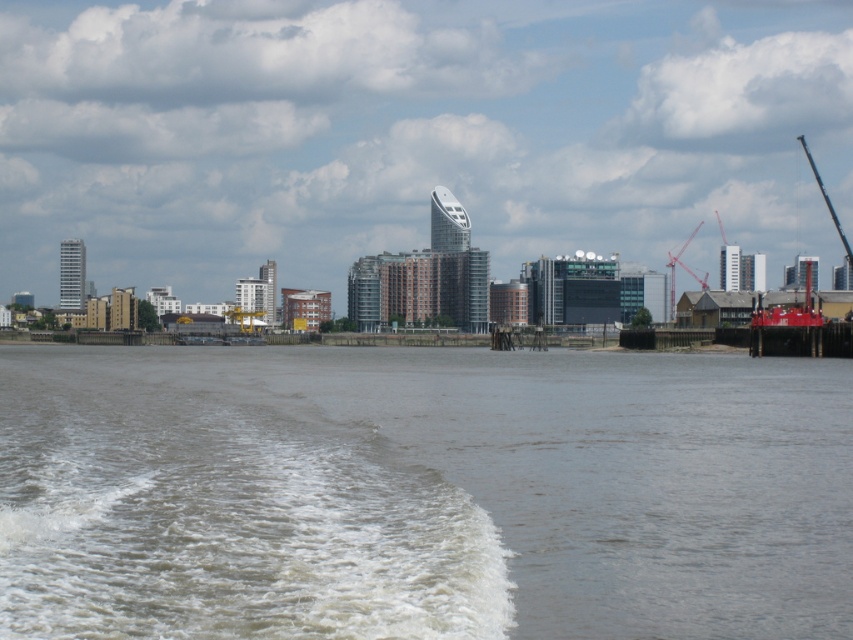
You are standing at the center of the image. Which direction should you face to look directly at the metallic red crane at right?

You should face to the right to look directly at the metallic red crane at right since it is located at the right side of the image.